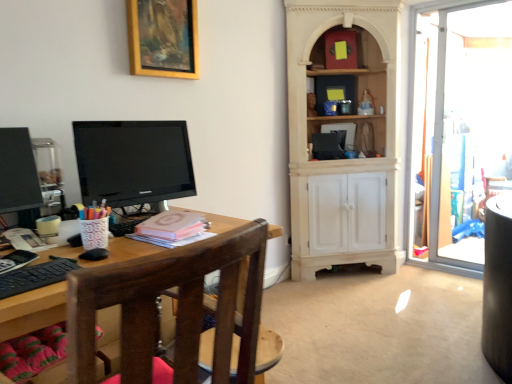
Question: Is pink matte book at center placed right next to matte black monitor at left?

Choices:
 (A) no
 (B) yes

Answer: (A)

Question: Would you say pink matte book at center is a long distance from matte black monitor at left?

Choices:
 (A) no
 (B) yes

Answer: (A)

Question: Is pink matte book at center to the right of matte black monitor at left from the viewer's perspective?

Choices:
 (A) yes
 (B) no

Answer: (A)

Question: From the image's perspective, would you say pink matte book at center is shown under matte black monitor at left?

Choices:
 (A) yes
 (B) no

Answer: (A)

Question: Is pink matte book at center to the left of matte black monitor at left from the viewer's perspective?

Choices:
 (A) no
 (B) yes

Answer: (A)

Question: Is pink matte book at center aimed at matte black monitor at left?

Choices:
 (A) no
 (B) yes

Answer: (A)

Question: Does brown wooden chair at left have a smaller size compared to matte black monitor at left?

Choices:
 (A) yes
 (B) no

Answer: (B)

Question: Can you confirm if brown wooden chair at left is thinner than matte black monitor at left?

Choices:
 (A) yes
 (B) no

Answer: (B)

Question: Is brown wooden chair at left to the left of matte black monitor at left from the viewer's perspective?

Choices:
 (A) no
 (B) yes

Answer: (A)

Question: Is brown wooden chair at left further to camera compared to matte black monitor at left?

Choices:
 (A) yes
 (B) no

Answer: (B)

Question: Considering the relative sizes of brown wooden chair at left and matte black monitor at left in the image provided, is brown wooden chair at left bigger than matte black monitor at left?

Choices:
 (A) yes
 (B) no

Answer: (A)

Question: Is matte black monitor at left completely or partially inside brown wooden chair at left?

Choices:
 (A) no
 (B) yes

Answer: (A)

Question: From a real-world perspective, is gold wooden picture frame at upper center located higher than brown wooden chair at left?

Choices:
 (A) no
 (B) yes

Answer: (B)